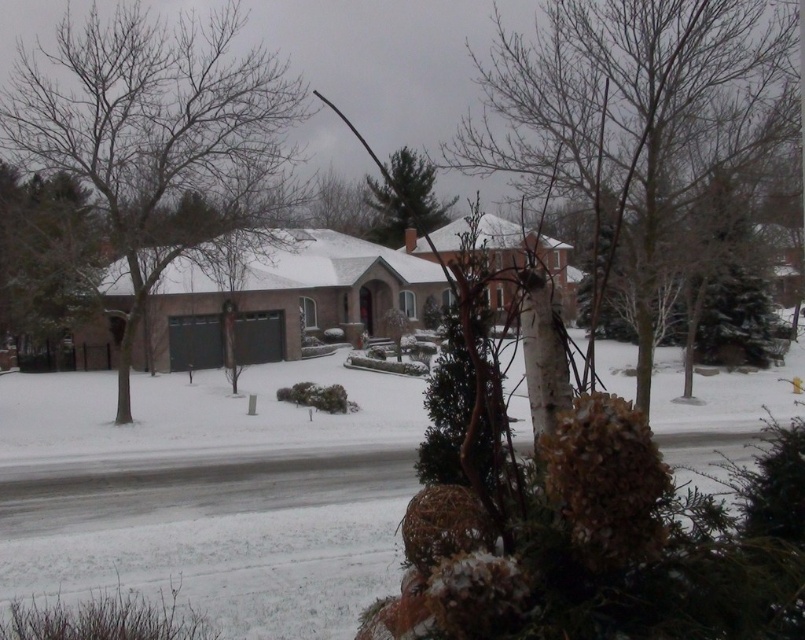
You are standing in the winter scene and want to place a small garden ornament between the bare wood tree at center and the green matte tree at center. The ornament requires at least 5 meters of space between the two trees to be placed safely. Can you place the ornament there?

The distance between the bare wood tree at center and the green matte tree at center is 6.32 meters, which is more than the required 5 meters. Therefore, you can safely place the ornament between them.

You are standing in the winter scene and want to determine which tree is taller between the brown leafless tree at left and the green textured evergreen tree at upper left. Based on the scene, which one is taller?

The brown leafless tree at left is taller than the green textured evergreen tree at upper left.

You are standing in the residential area and want to take a photo of the bare wood tree at center and the green textured evergreen tree at upper left. Which tree is closer to the camera?

The bare wood tree at center is closer to the camera because it is positioned over the green textured evergreen tree at upper left, indicating it is in front of it.